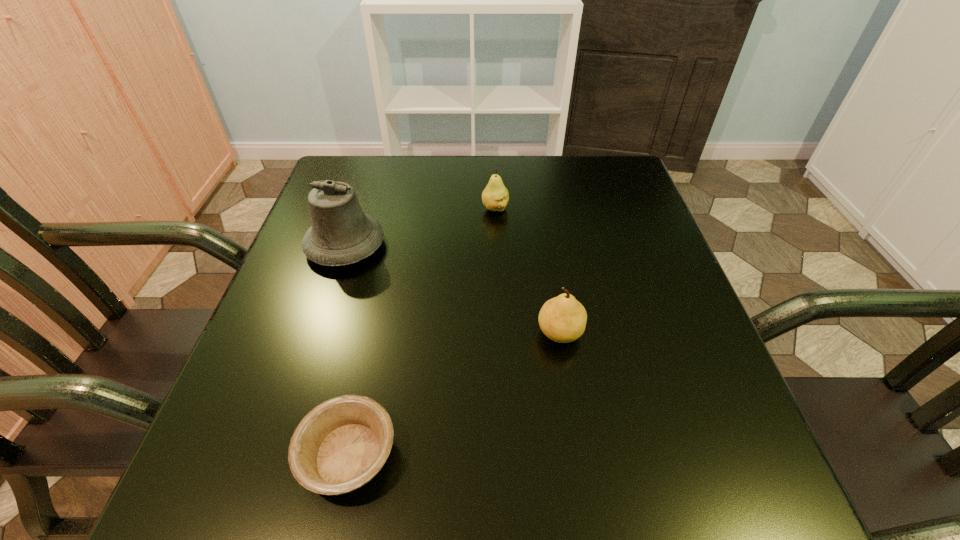
I want to click on unoccupied area between the nearer pear and the third nearest object, so click(x=452, y=289).

You are a GUI agent. You are given a task and a screenshot of the screen. Output one action in this format:
    pyautogui.click(x=<x>, y=<y>)
    Task: Click on the free space that is in between the right pear and the farther pear
    This screenshot has width=960, height=540.
    Given the screenshot: What is the action you would take?
    [527, 271]

At what (x,y) coordinates should I click in order to perform the action: click on unoccupied position between the bowl and the farthest object. Please return your answer as a coordinate pair (x, y). This screenshot has width=960, height=540. Looking at the image, I should click on (421, 332).

Select which object appears as the closest to the second farthest object. Please provide its 2D coordinates. Your answer should be formatted as a tuple, i.e. [(x, y)], where the tuple contains the x and y coordinates of a point satisfying the conditions above.

[(495, 197)]

Identify which object is located as the second nearest to the left pear. Please provide its 2D coordinates. Your answer should be formatted as a tuple, i.e. [(x, y)], where the tuple contains the x and y coordinates of a point satisfying the conditions above.

[(562, 319)]

Find the location of `vacant space that satisfies the following two spatial constraints: 1. on the back side of the tallest object; 2. on the right side of the farthest object`. vacant space that satisfies the following two spatial constraints: 1. on the back side of the tallest object; 2. on the right side of the farthest object is located at coordinates (357, 208).